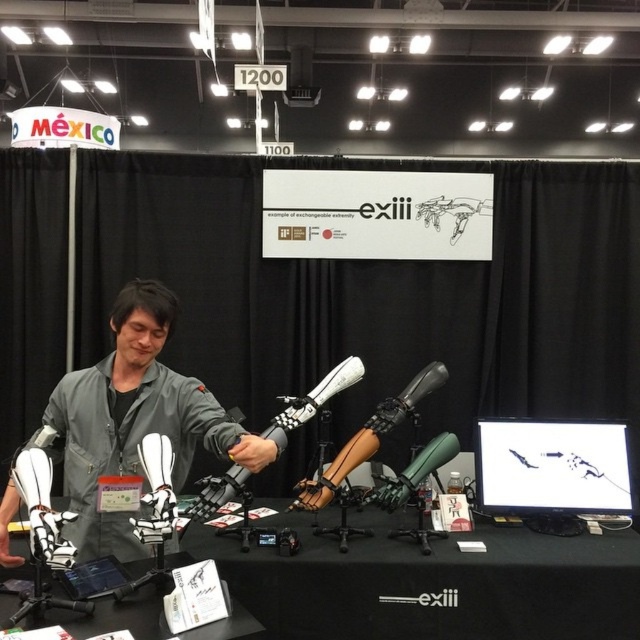
Question: Which of these objects is positioned farthest from the green matte microphone at center?

Choices:
 (A) yellow matte hand at center
 (B) black matte table at center
 (C) gray matte jacket at center
 (D) black matte microphone at center

Answer: (C)

Question: Observing the image, what is the correct spatial positioning of black matte microphone at center in reference to yellow matte hand at center?

Choices:
 (A) below
 (B) above

Answer: (B)

Question: Does white matte microphone at center appear on the right side of green matte microphone at center?

Choices:
 (A) no
 (B) yes

Answer: (A)

Question: Which of the following is the closest to the observer?

Choices:
 (A) white matte microphone at center
 (B) black glossy monitor at center

Answer: (A)

Question: Which point appears closest to the camera in this image?

Choices:
 (A) (259, 440)
 (B) (513, 426)
 (C) (372, 429)

Answer: (A)

Question: Is black glossy monitor at center above black matte microphone at center?

Choices:
 (A) yes
 (B) no

Answer: (B)